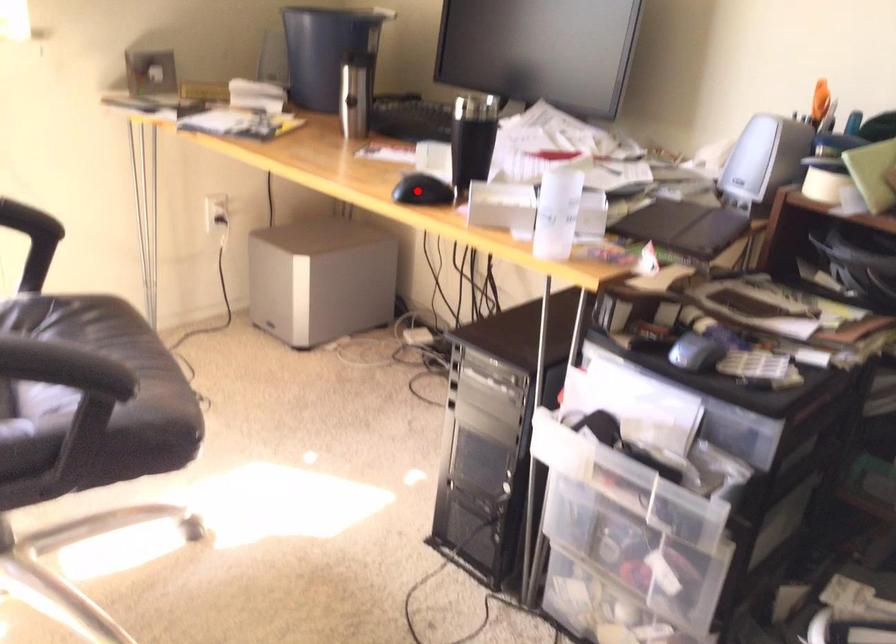
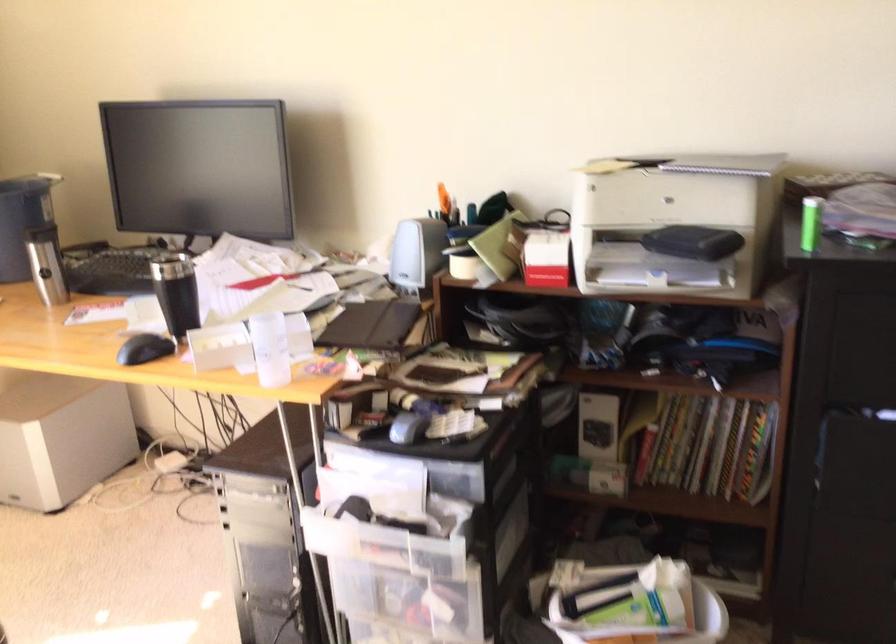
Question: I am providing you with two images of the same scene from different viewpoints. A red point is shown in image1. For the corresponding object point in image2, is it positioned nearer or farther from the camera?

Choices:
 (A) Nearer
 (B) Farther

Answer: (B)